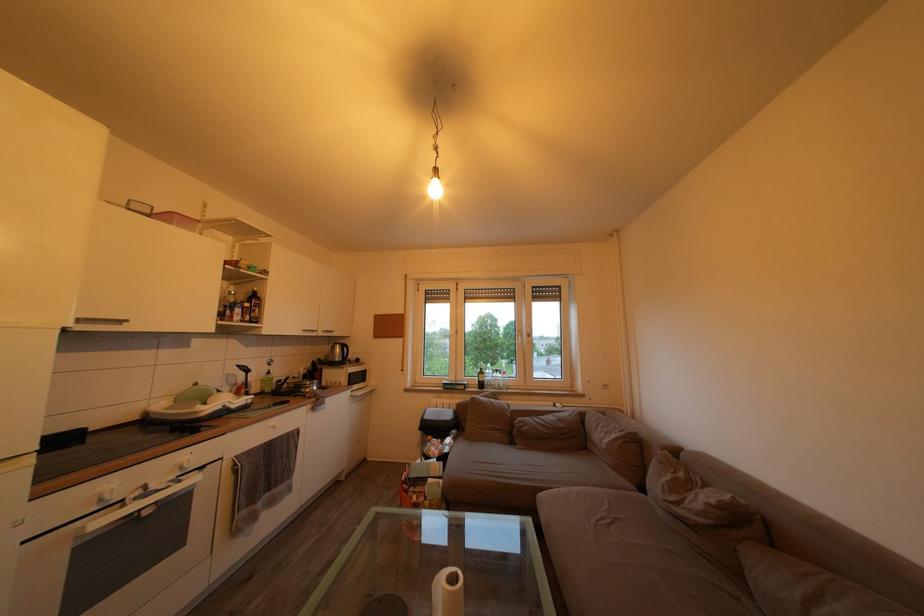
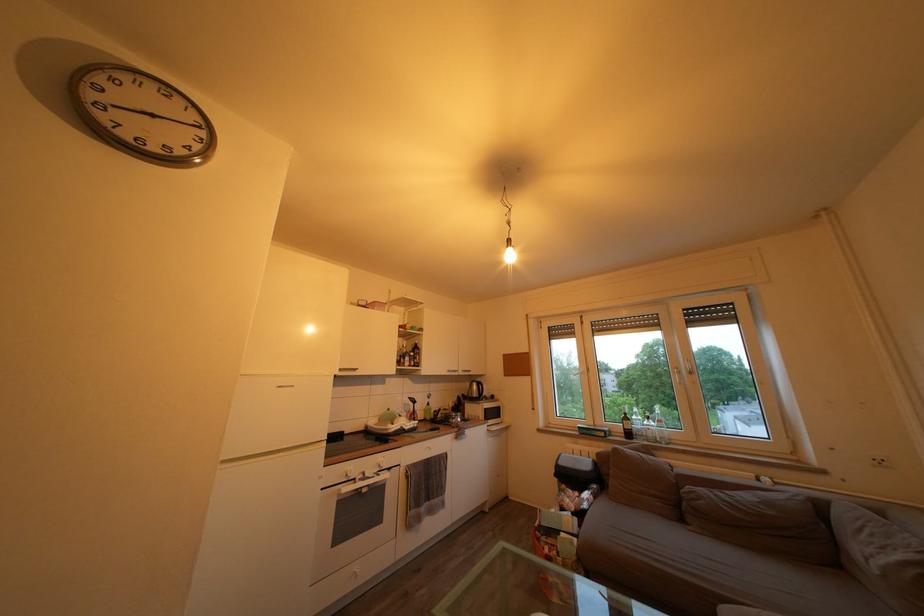
Find the pixel in the second image that matches pixel 487 379 in the first image.

(630, 426)